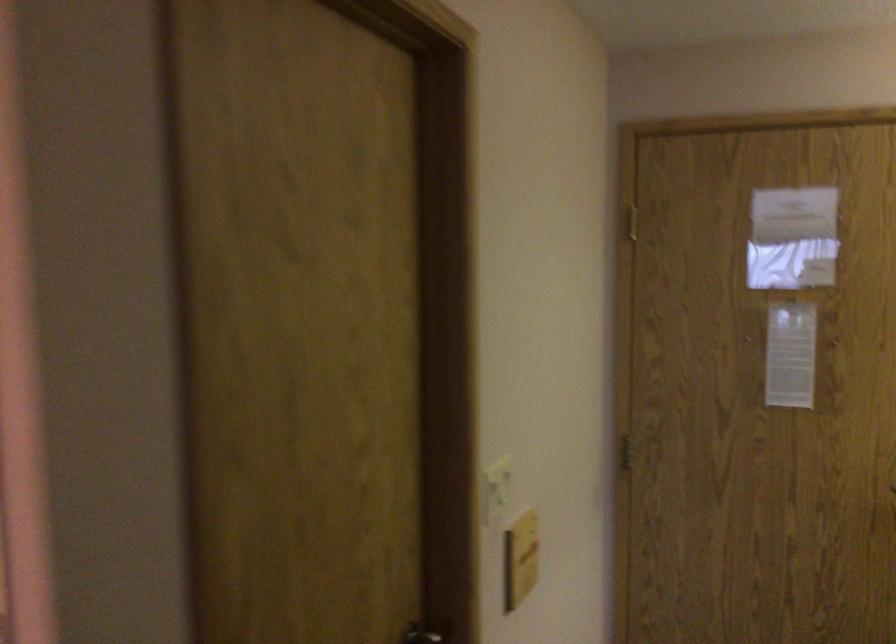
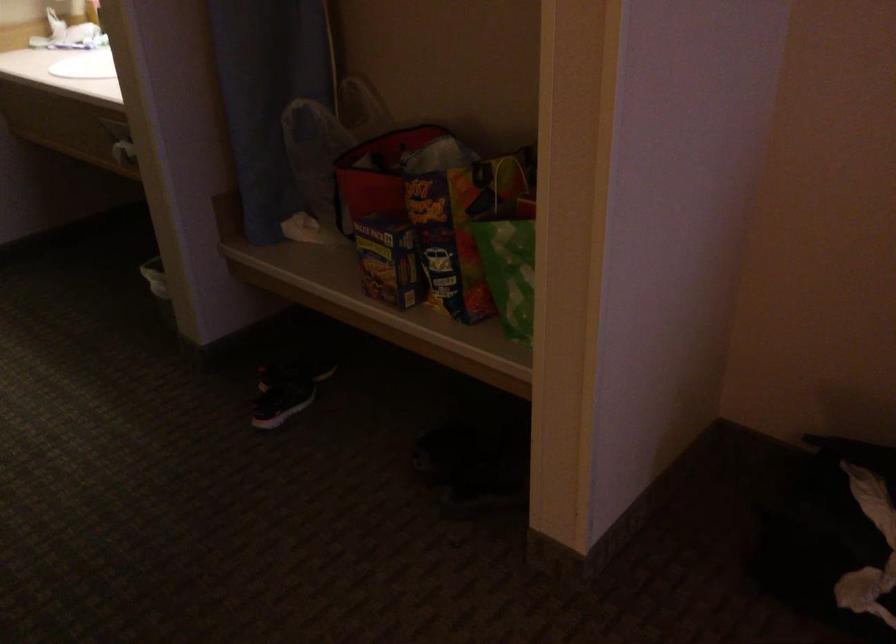
How did the camera likely rotate?

The camera's rotation is toward right-down.